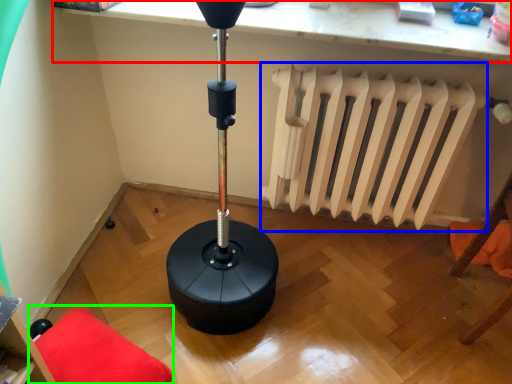
Question: Considering the real-world distances, which object is closest to computer (highlighted by a red box)? radiator (highlighted by a blue box) or furniture (highlighted by a green box).

Choices:
 (A) radiator
 (B) furniture

Answer: (A)